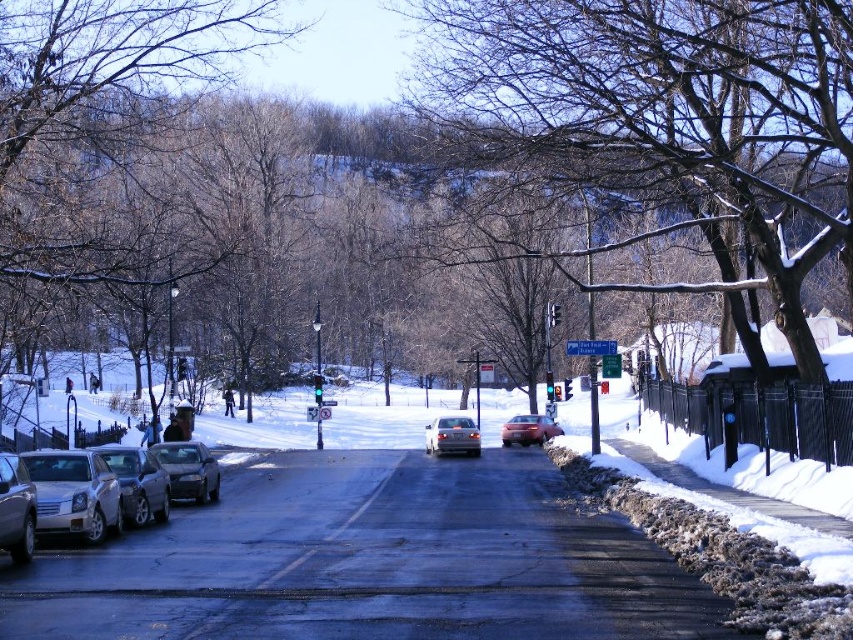
You are a parking attendant and need to fit both the satin silver sedan at center and the shiny silver sedan at center into a parking spot that is 2 meters wide. Based on their widths, which sedan should be placed first to ensure both can fit?

The satin silver sedan at center is thinner than the shiny silver sedan at center, so place the shiny silver sedan at center first, then the satin silver sedan at center to utilize the space effectively.